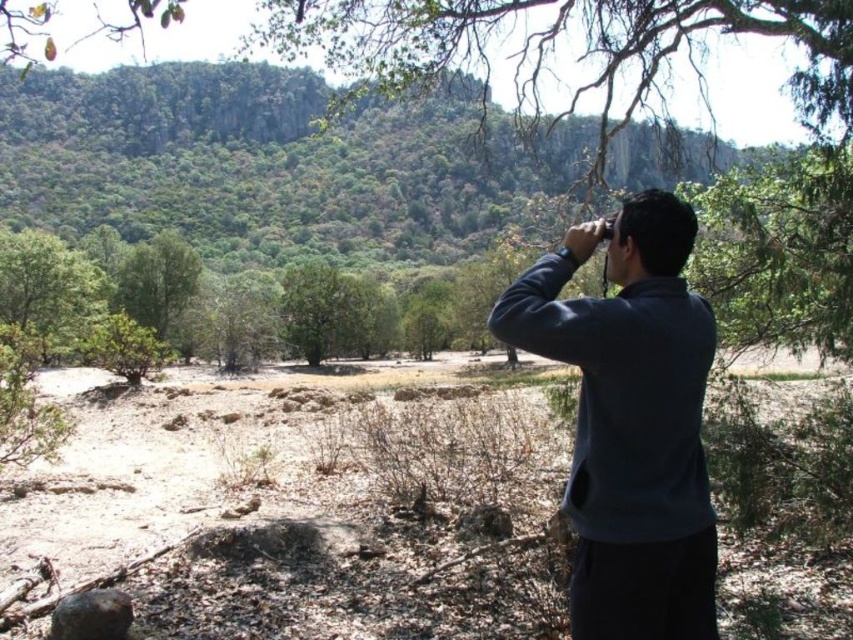
Who is positioned more to the right, green leafy tree at left or green leafy tree at center?

Answer: Positioned to the right is green leafy tree at left.

The image size is (853, 640). Describe the element at coordinates (47, 288) in the screenshot. I see `green leafy tree at left` at that location.

Does point (16, 253) lie behind point (167, 272)?

No, (16, 253) is closer to viewer.

Where is `green leafy tree at left`? This screenshot has width=853, height=640. green leafy tree at left is located at coordinates (47, 288).

Can you confirm if dark blue sweatshirt at right is positioned to the right of green leafy tree at center?

Indeed, dark blue sweatshirt at right is positioned on the right side of green leafy tree at center.

Which is more to the right, dark blue sweatshirt at right or green leafy tree at center?

From the viewer's perspective, dark blue sweatshirt at right appears more on the right side.

Which is in front, point (602, 419) or point (166, 280)?

Point (602, 419) is in front.

I want to click on dark blue sweatshirt at right, so click(x=630, y=420).

Is the position of green matte tree at center less distant than that of green leafy tree at center?

Yes, green matte tree at center is closer to the viewer.

Which is in front, point (320, 280) or point (161, 248)?

Point (320, 280) is more forward.

The width and height of the screenshot is (853, 640). What do you see at coordinates (323, 310) in the screenshot? I see `green matte tree at center` at bounding box center [323, 310].

The image size is (853, 640). I want to click on green matte tree at center, so click(x=323, y=310).